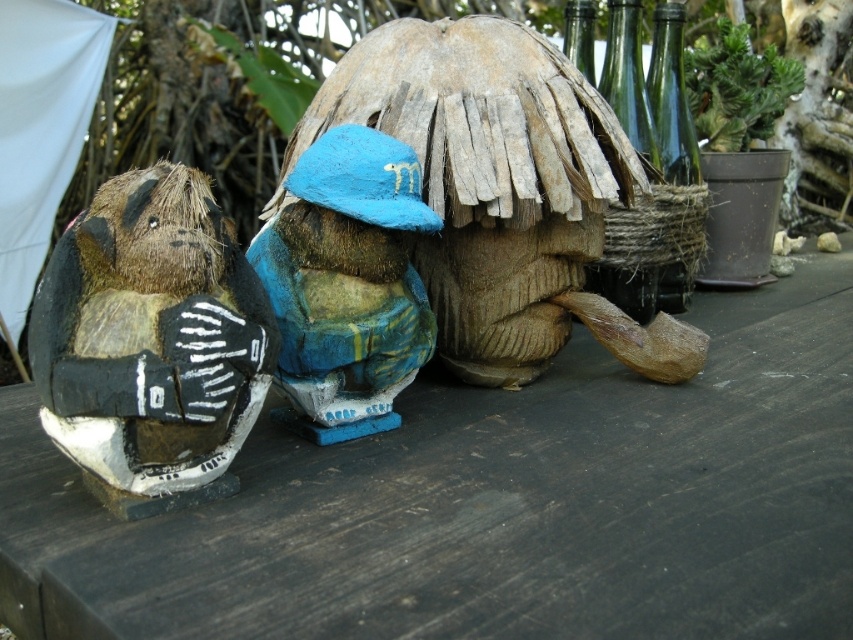
Question: Which of the following is the closest to the observer?

Choices:
 (A) green succulent at upper right
 (B) green glass bottle at right
 (C) fuzzy brown plush at left

Answer: (C)

Question: Which point is farther from the camera taking this photo?

Choices:
 (A) (708, 56)
 (B) (346, 157)
 (C) (201, 36)
 (D) (547, 93)

Answer: (C)

Question: From the image, what is the correct spatial relationship of blue painted wood figurine at center in relation to green succulent at upper right?

Choices:
 (A) below
 (B) above

Answer: (A)

Question: Among these objects, which one is farthest from the camera?

Choices:
 (A) green succulent at upper right
 (B) blue painted wood figurine at center

Answer: (A)

Question: Is wooden figure at center wider than green leafy plant at upper center?

Choices:
 (A) yes
 (B) no

Answer: (A)

Question: Can you confirm if fuzzy brown plush at left is thinner than green glass bottle at right?

Choices:
 (A) yes
 (B) no

Answer: (B)